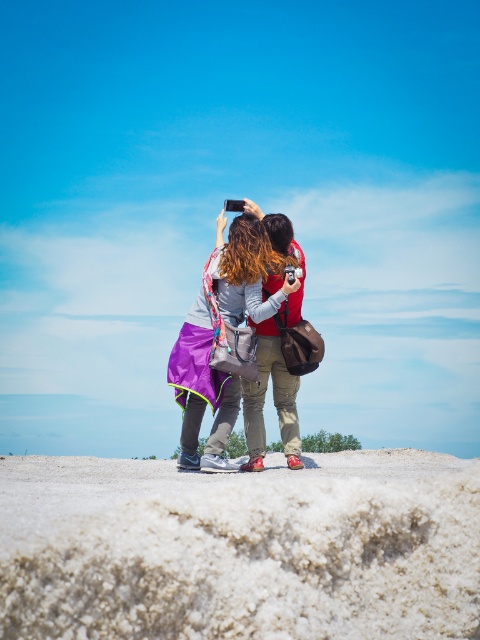
Who is shorter, purple fabric jacket at center or matte red shoes at center?

Standing shorter between the two is matte red shoes at center.

Between purple fabric jacket at center and matte red shoes at center, which one is positioned lower?

matte red shoes at center is below.

Locate an element on the screen. This screenshot has width=480, height=640. purple fabric jacket at center is located at coordinates (202, 390).